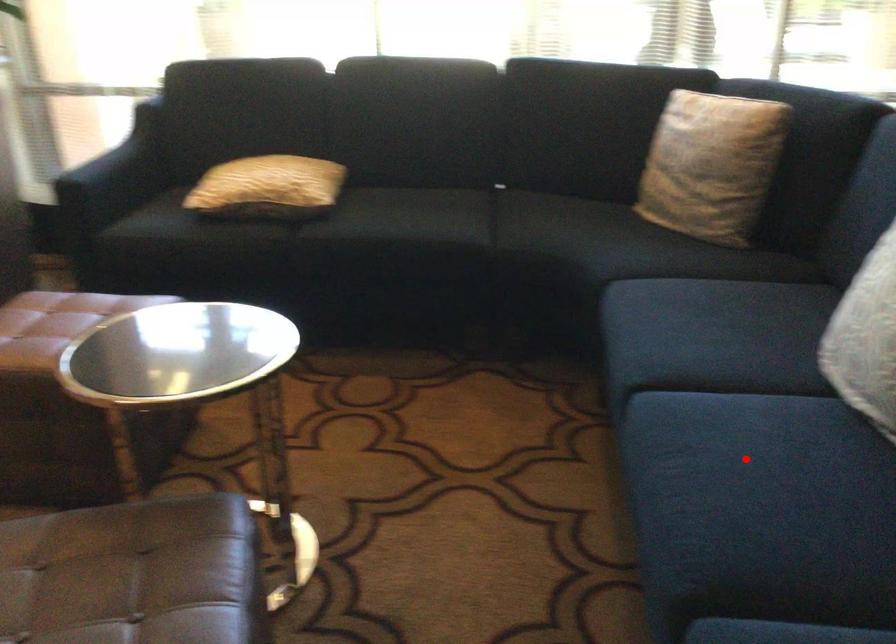
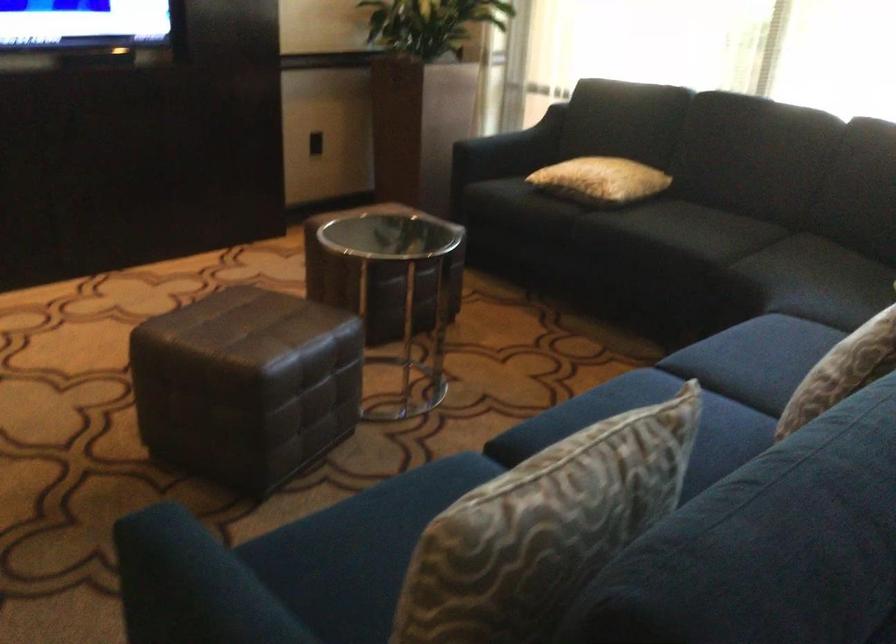
Question: I am providing you with two images of the same scene from different viewpoints. A red point is marked on the first image. Can you still see the location of the red point in image 2?

Choices:
 (A) Yes
 (B) No

Answer: (B)